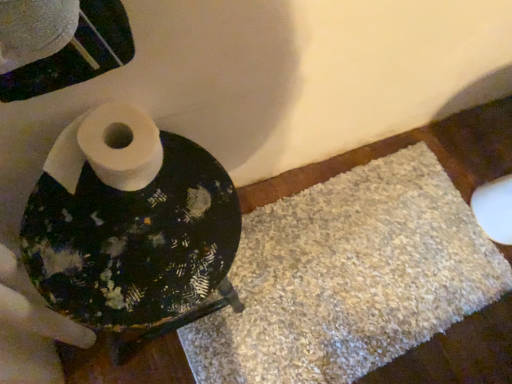
Describe the element at coordinates (349, 277) in the screenshot. The width and height of the screenshot is (512, 384). I see `white shaggy bath mat at lower right` at that location.

You are a GUI agent. You are given a task and a screenshot of the screen. Output one action in this format:
    pyautogui.click(x=<x>, y=<y>)
    Task: Click on the white shaggy bath mat at lower right
    The height and width of the screenshot is (384, 512).
    Given the screenshot: What is the action you would take?
    pyautogui.click(x=349, y=277)

What is the approximate width of white matte toilet paper at center?

white matte toilet paper at center is 5.10 inches in width.

Identify the location of white matte toilet paper at center. The width and height of the screenshot is (512, 384). (108, 149).

Describe the element at coordinates (108, 149) in the screenshot. I see `white matte toilet paper at center` at that location.

This screenshot has height=384, width=512. What are the coordinates of `white shaggy bath mat at lower right` in the screenshot? It's located at (349, 277).

Which is more to the left, white matte toilet paper at center or white shaggy bath mat at lower right?

Positioned to the left is white matte toilet paper at center.

Considering the positions of objects white matte toilet paper at center and white shaggy bath mat at lower right in the image provided, who is in front, white matte toilet paper at center or white shaggy bath mat at lower right?

white matte toilet paper at center is closer to the camera.

Does point (79, 167) come behind point (250, 221)?

No.

From the image's perspective, which object appears higher, white matte toilet paper at center or white shaggy bath mat at lower right?

white matte toilet paper at center, from the image's perspective.

From a real-world perspective, which is physically above, white matte toilet paper at center or white shaggy bath mat at lower right?

white matte toilet paper at center.

Considering the relative sizes of white matte toilet paper at center and white shaggy bath mat at lower right in the image provided, is white matte toilet paper at center thinner than white shaggy bath mat at lower right?

Yes, white matte toilet paper at center is thinner than white shaggy bath mat at lower right.

Which of these two, white matte toilet paper at center or white shaggy bath mat at lower right, stands shorter?

white shaggy bath mat at lower right is shorter.

Can you confirm if white matte toilet paper at center is bigger than white shaggy bath mat at lower right?

No, white matte toilet paper at center is not bigger than white shaggy bath mat at lower right.

Is white matte toilet paper at center situated inside white shaggy bath mat at lower right or outside?

white matte toilet paper at center exists outside the volume of white shaggy bath mat at lower right.

Are white matte toilet paper at center and white shaggy bath mat at lower right located far from each other?

No, white matte toilet paper at center is not far away from white shaggy bath mat at lower right.

Is white matte toilet paper at center oriented towards white shaggy bath mat at lower right?

No, white matte toilet paper at center is not oriented towards white shaggy bath mat at lower right.

Find the location of a particular element. toilet paper located above the white shaggy bath mat at lower right (from the image's perspective) is located at coordinates (108, 149).

Between white shaggy bath mat at lower right and white matte toilet paper at center, which one appears on the left side from the viewer's perspective?

white matte toilet paper at center is more to the left.

Between white shaggy bath mat at lower right and white matte toilet paper at center, which one is positioned in front?

white matte toilet paper at center is in front.

Does point (490, 252) come in front of point (91, 138)?

No.

From the image's perspective, relative to white matte toilet paper at center, is white shaggy bath mat at lower right above or below?

white shaggy bath mat at lower right is situated lower than white matte toilet paper at center in the image.

From a real-world perspective, relative to white matte toilet paper at center, is white shaggy bath mat at lower right vertically above or below?

white shaggy bath mat at lower right is situated lower than white matte toilet paper at center in the real world.

Considering the sizes of objects white shaggy bath mat at lower right and white matte toilet paper at center in the image provided, who is thinner, white shaggy bath mat at lower right or white matte toilet paper at center?

white matte toilet paper at center.

Is white shaggy bath mat at lower right shorter than white matte toilet paper at center?

Yes.

Considering the relative sizes of white shaggy bath mat at lower right and white matte toilet paper at center in the image provided, is white shaggy bath mat at lower right smaller than white matte toilet paper at center?

No, white shaggy bath mat at lower right is not smaller than white matte toilet paper at center.

In the scene shown: Is white shaggy bath mat at lower right outside of white matte toilet paper at center?

Indeed, white shaggy bath mat at lower right is completely outside white matte toilet paper at center.

Would you consider white shaggy bath mat at lower right to be distant from white matte toilet paper at center?

No, white shaggy bath mat at lower right is not far away from white matte toilet paper at center.

Is white shaggy bath mat at lower right facing towards white matte toilet paper at center?

No, white shaggy bath mat at lower right is not turned towards white matte toilet paper at center.

Where is `bath mat located below the white matte toilet paper at center (from the image's perspective)`? This screenshot has width=512, height=384. bath mat located below the white matte toilet paper at center (from the image's perspective) is located at coordinates (349, 277).

The width and height of the screenshot is (512, 384). Find the location of `toilet paper that appears in front of the white shaggy bath mat at lower right`. toilet paper that appears in front of the white shaggy bath mat at lower right is located at coordinates (108, 149).

Locate an element on the screen. The width and height of the screenshot is (512, 384). toilet paper located on the left of white shaggy bath mat at lower right is located at coordinates (108, 149).